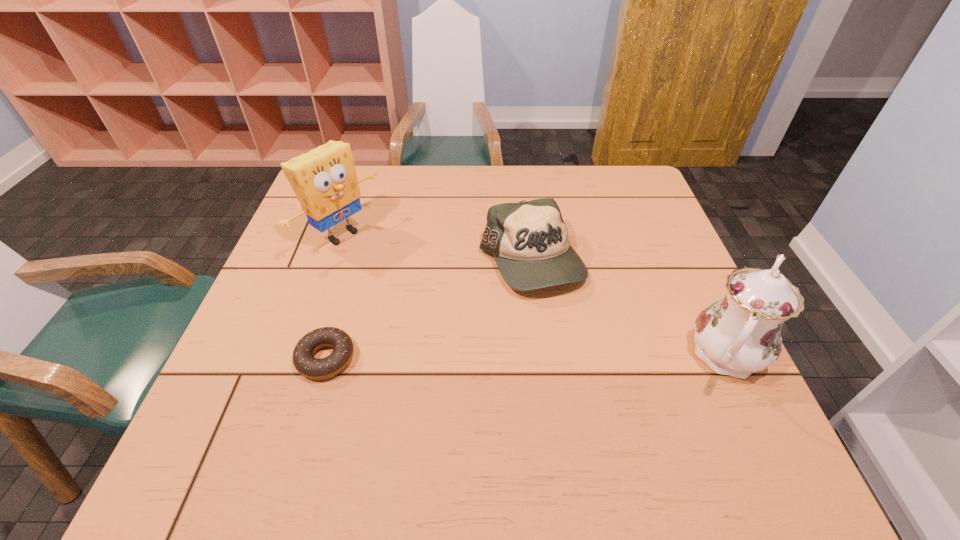
Where is `free space located on the front-facing side of the baseball cap`? The width and height of the screenshot is (960, 540). free space located on the front-facing side of the baseball cap is located at coordinates (565, 379).

Locate an element on the screen. The width and height of the screenshot is (960, 540). vacant region located 0.070m on the front-facing side of the baseball cap is located at coordinates (550, 325).

Locate an element on the screen. free space located on the front-facing side of the baseball cap is located at coordinates (549, 321).

Identify the location of object located in the far edge section of the desktop. The image size is (960, 540). (324, 180).

The height and width of the screenshot is (540, 960). What are the coordinates of `doughnut present at the near edge` in the screenshot? It's located at (306, 364).

Locate an element on the screen. chinaware situated at the near edge is located at coordinates (740, 334).

Identify the location of doughnut that is positioned at the left edge. Image resolution: width=960 pixels, height=540 pixels. (306, 364).

At what (x,y) coordinates should I click in order to perform the action: click on sponge situated at the left edge. Please return your answer as a coordinate pair (x, y). Looking at the image, I should click on (324, 180).

In order to click on object that is at the right edge in this screenshot , I will do `click(740, 334)`.

Identify the location of object that is at the far left corner. (324, 180).